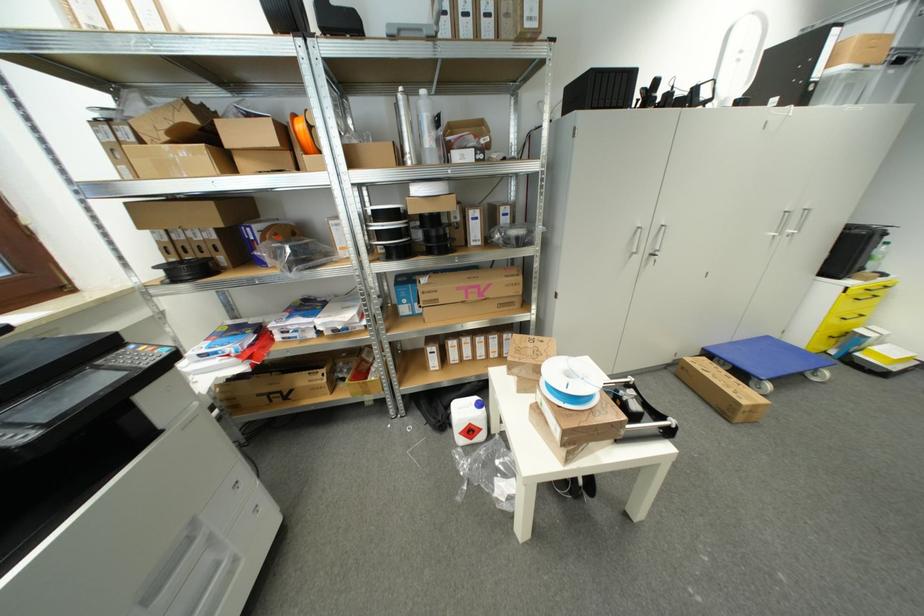
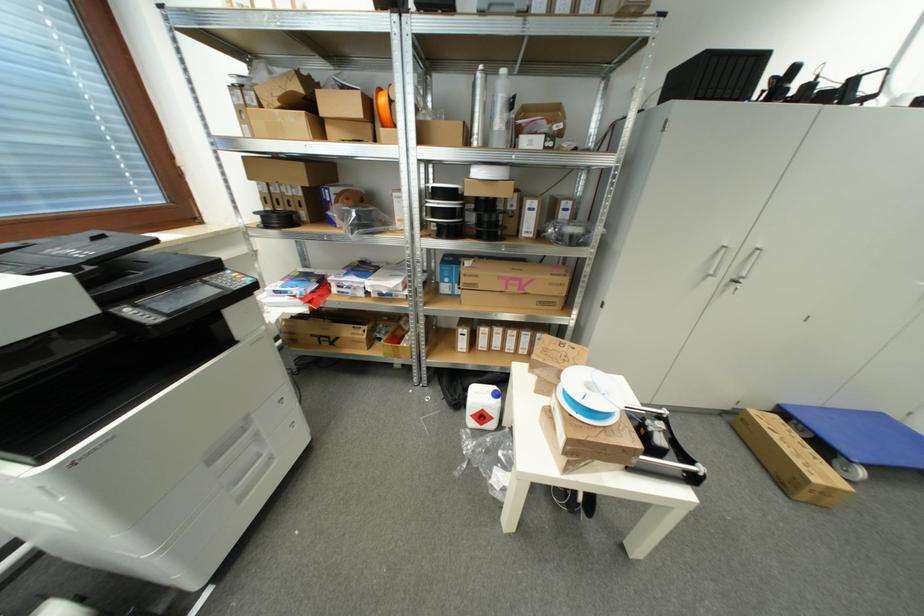
Locate, in the second image, the point that corresponds to point (329, 373) in the first image.

(370, 330)